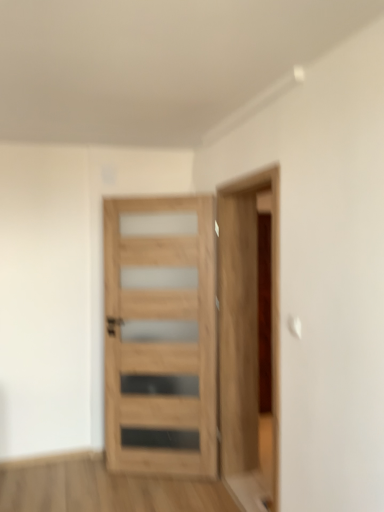
Question: Considering the relative positions of wooden door at right and natural wood door at center in the image provided, is wooden door at right to the left or to the right of natural wood door at center?

Choices:
 (A) right
 (B) left

Answer: (A)

Question: From a real-world perspective, is wooden door at right physically located above or below natural wood door at center?

Choices:
 (A) above
 (B) below

Answer: (A)

Question: From the image's perspective, is wooden door at right above or below natural wood door at center?

Choices:
 (A) above
 (B) below

Answer: (A)

Question: In the image, is natural wood door at center positioned in front of or behind wooden door at right?

Choices:
 (A) front
 (B) behind

Answer: (B)

Question: From their relative heights in the image, would you say natural wood door at center is taller or shorter than wooden door at right?

Choices:
 (A) short
 (B) tall

Answer: (A)

Question: From the image's perspective, is natural wood door at center above or below wooden door at right?

Choices:
 (A) above
 (B) below

Answer: (B)

Question: Does point (187, 464) appear closer or farther from the camera than point (244, 371)?

Choices:
 (A) closer
 (B) farther

Answer: (A)